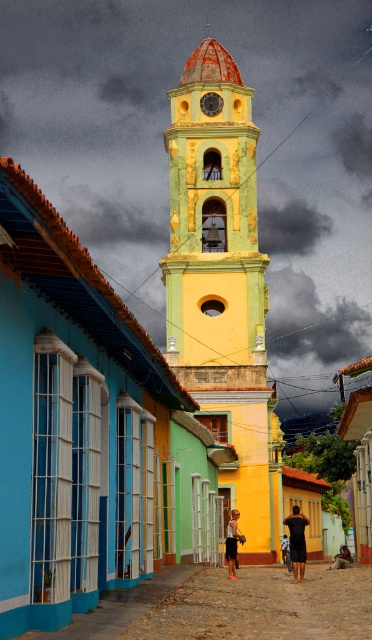
Does yellow matte bell tower at center lie in front of cobblestone street at center?

That is False.

Is yellow matte bell tower at center shorter than cobblestone street at center?

No, yellow matte bell tower at center is not shorter than cobblestone street at center.

Measure the distance between yellow matte bell tower at center and camera.

The distance of yellow matte bell tower at center from camera is 90.16 meters.

In order to click on yellow matte bell tower at center in this screenshot , I will do `click(222, 289)`.

Can you confirm if cobblestone street at center is bigger than dark skin human at center?

Yes, cobblestone street at center is bigger than dark skin human at center.

Measure the distance between point (238, 612) and camera.

Point (238, 612) and camera are 39.43 meters apart.

Identify the location of cobblestone street at center. This screenshot has width=372, height=640. (233, 608).

Does metallic clock face at center appear on the left side of dark brown leather bag at center?

Yes, metallic clock face at center is to the left of dark brown leather bag at center.

Is metallic clock face at center positioned behind dark brown leather bag at center?

Yes, it is behind dark brown leather bag at center.

The image size is (372, 640). I want to click on metallic clock face at center, so click(x=210, y=104).